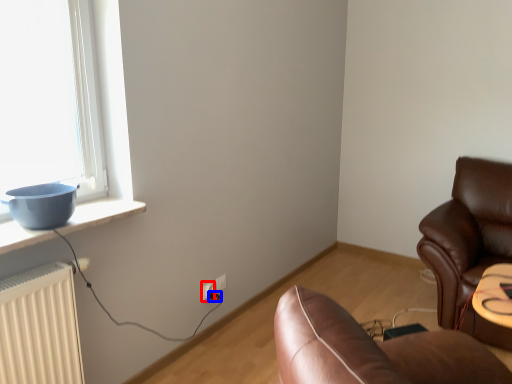
Question: Among these objects, which one is nearest to the camera, electric outlet (highlighted by a red box) or plug (highlighted by a blue box)?

Choices:
 (A) electric outlet
 (B) plug

Answer: (A)